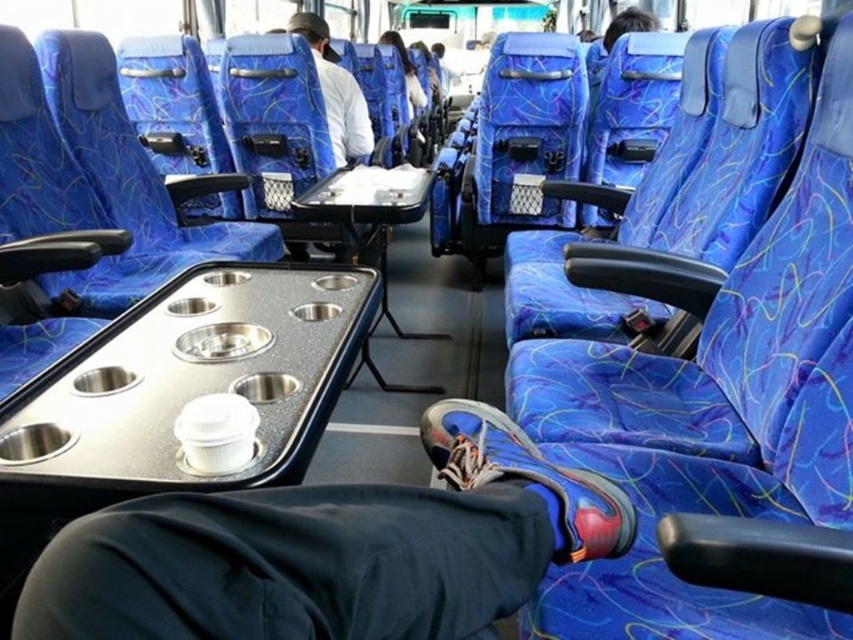
The height and width of the screenshot is (640, 853). Describe the element at coordinates (334, 548) in the screenshot. I see `shiny plastic cup at center` at that location.

Does shiny plastic cup at center appear under blue fabric seat at center?

Indeed, shiny plastic cup at center is positioned under blue fabric seat at center.

This screenshot has height=640, width=853. Identify the location of shiny plastic cup at center. (334, 548).

Which of these two, blue synthetic shoe at lower center or blue fabric seat at center, stands shorter?

Standing shorter between the two is blue synthetic shoe at lower center.

Who is more distant from viewer, (485, 470) or (453, 17)?

The point (453, 17) is more distant.

Locate an element on the screen. This screenshot has width=853, height=640. blue synthetic shoe at lower center is located at coordinates coord(527,476).

Describe the element at coordinates (334, 548) in the screenshot. This screenshot has height=640, width=853. I see `shiny plastic cup at center` at that location.

Can you confirm if shiny plastic cup at center is smaller than matte white shirt at center?

Correct, shiny plastic cup at center occupies less space than matte white shirt at center.

Image resolution: width=853 pixels, height=640 pixels. Find the location of `shiny plastic cup at center`. shiny plastic cup at center is located at coordinates (334, 548).

Locate an element on the screen. shiny plastic cup at center is located at coordinates click(334, 548).